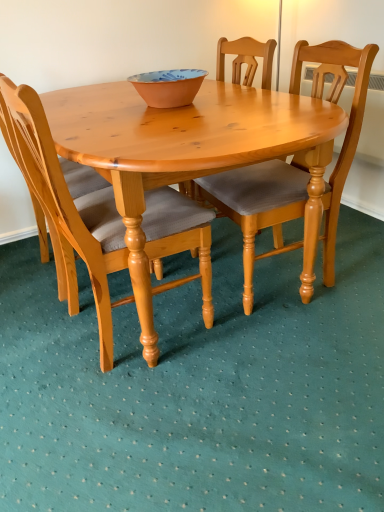
Identify the location of vacant region under light brown wood chair at center, the second chair viewed from the left (from a real-world perspective). (276, 279).